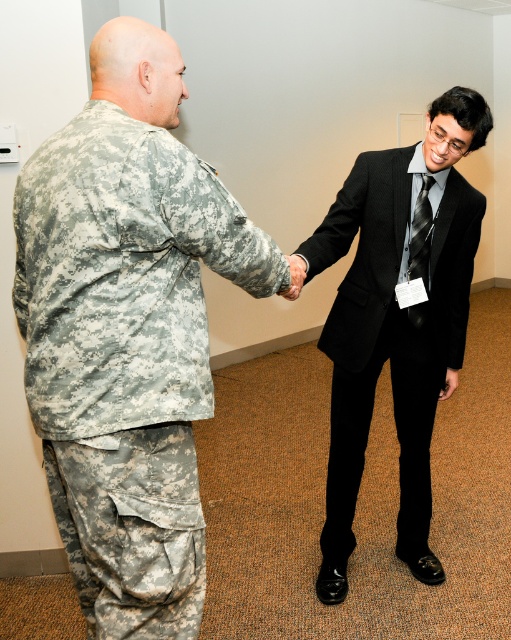
Question: Which point is farther to the camera?

Choices:
 (A) camouflage fabric uniform at left
 (B) black silk suit at center
 (C) black textured tie at center

Answer: (C)

Question: Does camouflage fabric uniform at left appear on the right side of black textured tie at center?

Choices:
 (A) no
 (B) yes

Answer: (A)

Question: Among these objects, which one is nearest to the camera?

Choices:
 (A) camouflage fabric uniform at left
 (B) black textured tie at center

Answer: (A)

Question: Which point is farther to the camera?

Choices:
 (A) (223, 266)
 (B) (415, 321)

Answer: (B)

Question: Does camouflage fabric uniform at left appear over black textured tie at center?

Choices:
 (A) no
 (B) yes

Answer: (A)

Question: Can you confirm if black silk suit at center is positioned below black textured tie at center?

Choices:
 (A) no
 (B) yes

Answer: (B)